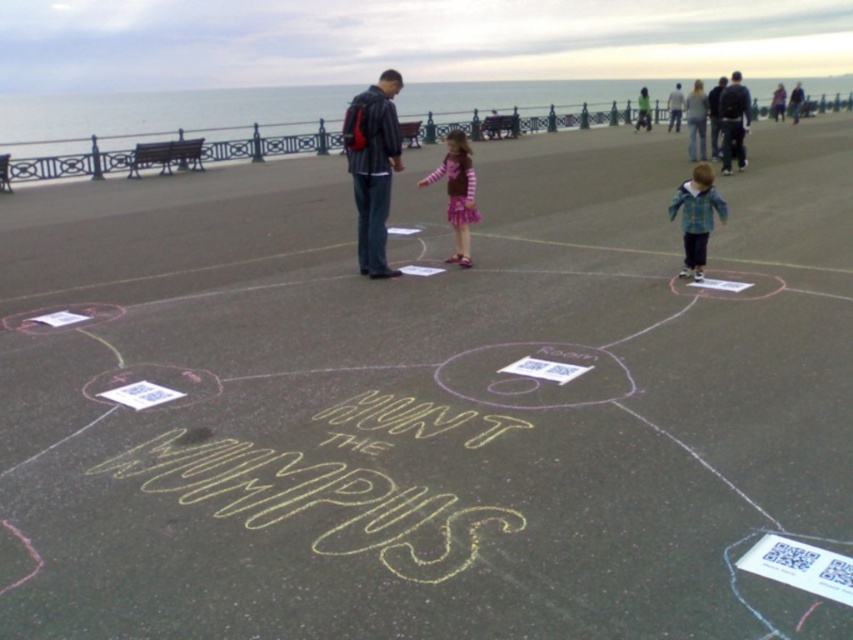
Question: Which object appears farthest from the camera in this image?

Choices:
 (A) plaid fabric jacket at center
 (B) dark blue jacket at upper right

Answer: (B)

Question: Which object is closer to the camera taking this photo?

Choices:
 (A) light gray shirt at center
 (B) matte black jacket at center
 (C) striped fabric dress at center

Answer: (B)

Question: Can you confirm if plaid fabric jacket at center is positioned to the left of light gray shirt at center?

Choices:
 (A) yes
 (B) no

Answer: (A)

Question: Observing the image, what is the correct spatial positioning of striped fabric dress at center in reference to dark blue jacket at center?

Choices:
 (A) below
 (B) above

Answer: (A)

Question: Observing the image, what is the correct spatial positioning of striped fabric dress at center in reference to light gray shirt at center?

Choices:
 (A) right
 (B) left

Answer: (B)

Question: Which object is positioned closest to the dark blue jacket at center?

Choices:
 (A) light gray shirt at center
 (B) dark blue jacket at upper right
 (C) matte black jacket at center
 (D) plaid fabric jacket at center

Answer: (B)